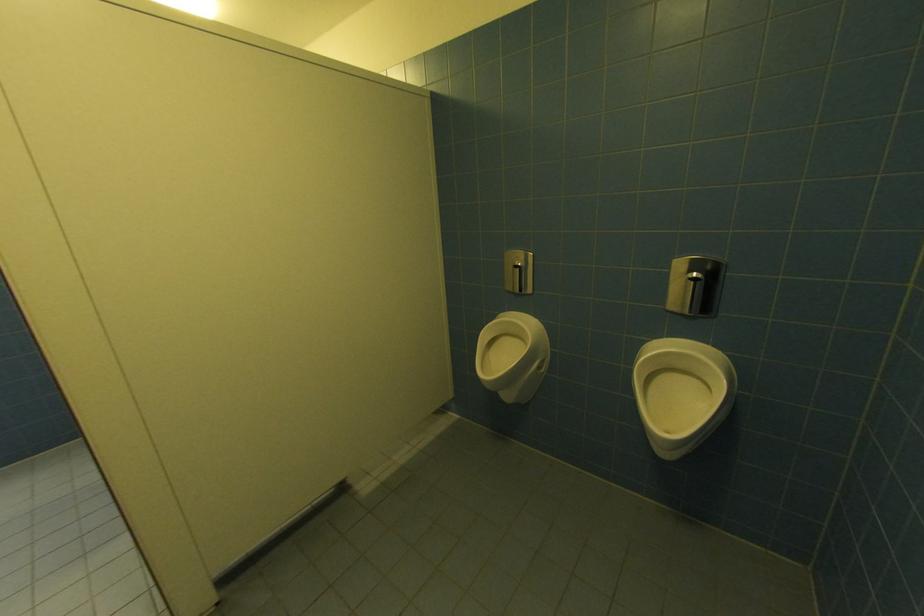
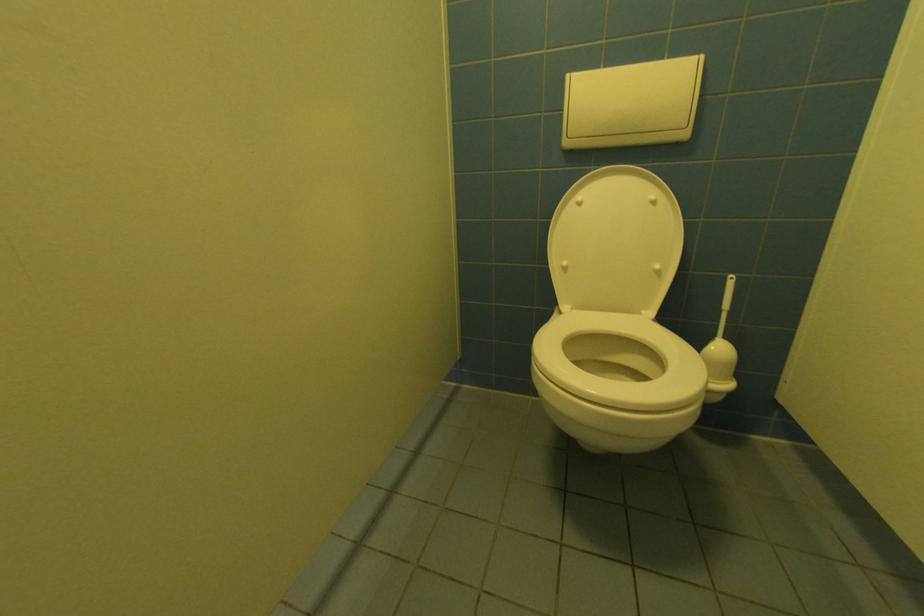
In a continuous first-person perspective shot, in which direction is the camera moving?

The cameraman moved toward left, forward.